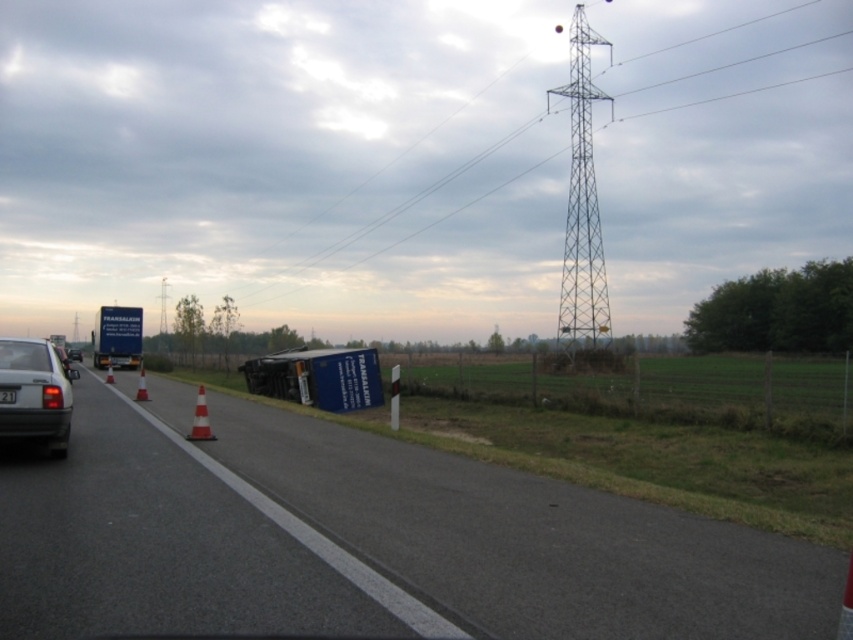
Between matte gray sedan at left and white striped cone at road center, which one is positioned higher?

matte gray sedan at left

Can you confirm if matte gray sedan at left is positioned below white striped cone at road center?

Actually, matte gray sedan at left is above white striped cone at road center.

Between point (62, 384) and point (190, 429), which one is positioned in front?

Point (62, 384) is more forward.

I want to click on matte gray sedan at left, so click(35, 394).

Does matte gray sedan at left have a lesser height compared to silver metallic sedan at left?

Yes.

Is matte gray sedan at left thinner than silver metallic sedan at left?

Indeed, matte gray sedan at left has a lesser width compared to silver metallic sedan at left.

Is point (32, 380) behind point (74, 376)?

No, it is in front of (74, 376).

Locate an element on the screen. matte gray sedan at left is located at coordinates (35, 394).

How distant is metallic grid tower at upper right from black plastic license plate at center?

The distance of metallic grid tower at upper right from black plastic license plate at center is 69.66 meters.

Is point (607, 321) more distant than point (3, 396)?

Yes, point (607, 321) is farther from viewer.

Is point (579, 342) farther from viewer compared to point (15, 390)?

Yes, point (579, 342) is farther from viewer.

Image resolution: width=853 pixels, height=640 pixels. What are the coordinates of `metallic grid tower at upper right` in the screenshot? It's located at (582, 205).